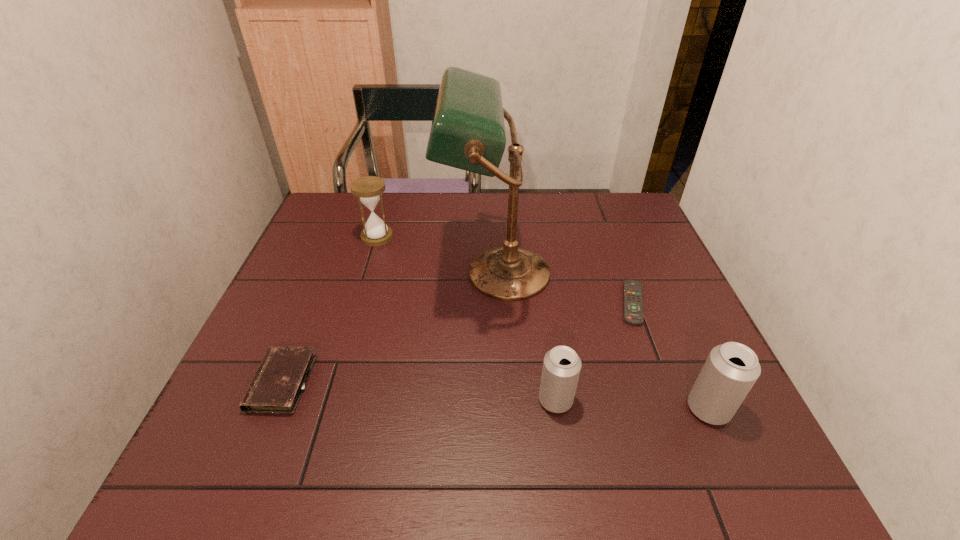
In the current image, all beer cans are evenly spaced. To maintain this equal spacing, where should an additional beer can be placed on the left? Please point out a free spot. Please provide its 2D coordinates. Your answer should be formatted as a tuple, i.e. [(x, y)], where the tuple contains the x and y coordinates of a point satisfying the conditions above.

[(408, 392)]